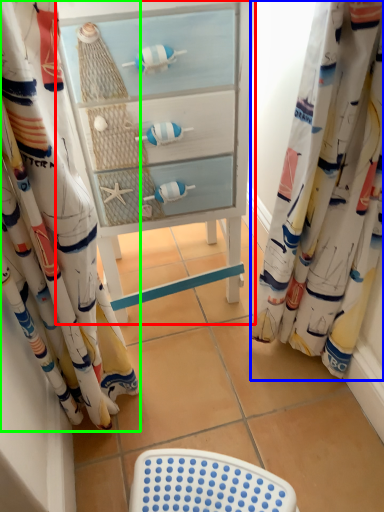
Question: Based on their relative distances, which object is nearer to furniture (highlighted by a red box)? Choose from curtain (highlighted by a blue box) and curtain (highlighted by a green box).

Choices:
 (A) curtain
 (B) curtain

Answer: (B)